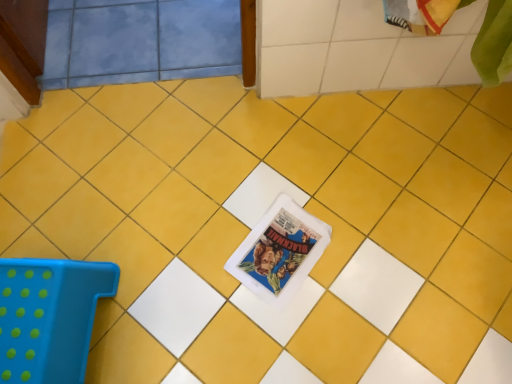
Where is `free space to the left of matte plastic comic book at center`? The width and height of the screenshot is (512, 384). free space to the left of matte plastic comic book at center is located at coordinates (205, 252).